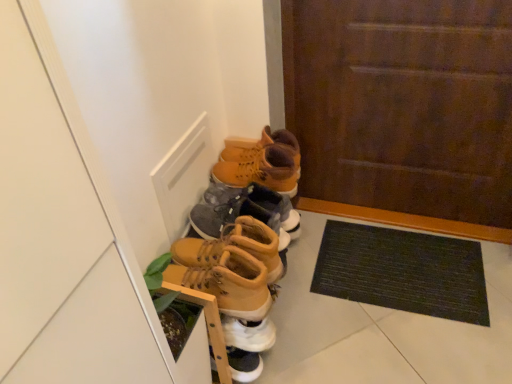
How much space does leather tan boots at center, which ranks as the third footwear in bottom-to-top order, occupy horizontally?

It is 13.01 inches.

This screenshot has height=384, width=512. Describe the element at coordinates (402, 271) in the screenshot. I see `black rubber doormat at lower right` at that location.

Where is `leather tan boots at center, the 5th footwear viewed from the top`? This screenshot has height=384, width=512. leather tan boots at center, the 5th footwear viewed from the top is located at coordinates (229, 283).

Measure the distance between leather tan boots at center, which is the first footwear in bottom-to-top order, and camera.

A distance of 1.02 meters exists between leather tan boots at center, which is the first footwear in bottom-to-top order, and camera.

Find the location of a particular element. matte yellow boots at center, which ranks as the 2th footwear in top-to-bottom order is located at coordinates (244, 211).

Image resolution: width=512 pixels, height=384 pixels. Find the location of `leather tan boots at center, which ranks as the third footwear in bottom-to-top order`. leather tan boots at center, which ranks as the third footwear in bottom-to-top order is located at coordinates (234, 245).

Based on their positions, is black rubber doormat at lower right located to the left or right of matte yellow boots at center, which ranks as the 2th footwear in top-to-bottom order?

Clearly, black rubber doormat at lower right is on the right of matte yellow boots at center, which ranks as the 2th footwear in top-to-bottom order, in the image.

Who is shorter, black rubber doormat at lower right or matte yellow boots at center, which ranks as the 2th footwear in top-to-bottom order?

black rubber doormat at lower right.

Is point (403, 239) less distant than point (217, 221)?

No.

How much distance is there between black rubber doormat at lower right and matte yellow boots at center, which ranks as the 2th footwear in top-to-bottom order?

black rubber doormat at lower right is 17.53 inches from matte yellow boots at center, which ranks as the 2th footwear in top-to-bottom order.

Who is smaller, black rubber doormat at lower right or matte brown boot at center, which appears as the second footwear when ordered from the bottom?

black rubber doormat at lower right.

Is black rubber doormat at lower right oriented away from matte brown boot at center, acting as the fourth footwear starting from the top?

No, matte brown boot at center, acting as the fourth footwear starting from the top, is not at the back of black rubber doormat at lower right.

What's the angular difference between black rubber doormat at lower right and matte brown boot at center, acting as the fourth footwear starting from the top,'s facing directions?

88.2 degrees separate the facing orientations of black rubber doormat at lower right and matte brown boot at center, acting as the fourth footwear starting from the top.

From a real-world perspective, is black rubber doormat at lower right physically above matte brown boot at center, which appears as the second footwear when ordered from the bottom?

No, from a real-world perspective, black rubber doormat at lower right is not over matte brown boot at center, which appears as the second footwear when ordered from the bottom

Could you tell me if leather tan boots at center, which is the first footwear in bottom-to-top order, is facing black rubber doormat at lower right?

No, leather tan boots at center, which is the first footwear in bottom-to-top order, is not aimed at black rubber doormat at lower right.

From the image's perspective, is leather tan boots at center, which is the first footwear in bottom-to-top order, above black rubber doormat at lower right?

Yes, from the image's perspective, leather tan boots at center, which is the first footwear in bottom-to-top order, is above black rubber doormat at lower right.

From a real-world perspective, is leather tan boots at center, which is the first footwear in bottom-to-top order, on black rubber doormat at lower right?

Yes, from a real-world perspective, leather tan boots at center, which is the first footwear in bottom-to-top order, is above black rubber doormat at lower right.

Is leather tan boots at center, which is the first footwear in bottom-to-top order, in front of or behind black rubber doormat at lower right in the image?

leather tan boots at center, which is the first footwear in bottom-to-top order, is positioned closer to the viewer than black rubber doormat at lower right.

Which is closer to the camera, (239,219) or (283,227)?

Point (239,219).

From a real-world perspective, is leather tan boots at center, which ranks as the third footwear in bottom-to-top order, above or below matte yellow boots at center, which ranks as the 2th footwear in top-to-bottom order?

In terms of real-world spatial position, leather tan boots at center, which ranks as the third footwear in bottom-to-top order, is below matte yellow boots at center, which ranks as the 2th footwear in top-to-bottom order.

Which object is further away from the camera, leather tan boots at center, which ranks as the third footwear in bottom-to-top order, or matte yellow boots at center, which is the 4th footwear from bottom to top?

matte yellow boots at center, which is the 4th footwear from bottom to top, is further from the camera.

Which object is positioned more to the right, leather tan boots at center, the third footwear in the top-to-bottom sequence, or matte yellow boots at center, which ranks as the 2th footwear in top-to-bottom order?

matte yellow boots at center, which ranks as the 2th footwear in top-to-bottom order, is more to the right.

From the image's perspective, is matte brown boot at center, acting as the fourth footwear starting from the top, located above leather tan boots at center, the third footwear in the top-to-bottom sequence?

No.

Considering the sizes of objects matte brown boot at center, acting as the fourth footwear starting from the top, and leather tan boots at center, which ranks as the third footwear in bottom-to-top order, in the image provided, who is taller, matte brown boot at center, acting as the fourth footwear starting from the top, or leather tan boots at center, which ranks as the third footwear in bottom-to-top order,?

With more height is matte brown boot at center, acting as the fourth footwear starting from the top.

Does matte brown boot at center, acting as the fourth footwear starting from the top, appear on the left side of leather tan boots at center, which ranks as the third footwear in bottom-to-top order?

In fact, matte brown boot at center, acting as the fourth footwear starting from the top, is to the right of leather tan boots at center, which ranks as the third footwear in bottom-to-top order.

From the image's perspective, which one is positioned higher, matte yellow leather boots at center, the fifth footwear ordered from the bottom, or matte yellow boots at center, which ranks as the 2th footwear in top-to-bottom order?

matte yellow leather boots at center, the fifth footwear ordered from the bottom, appears higher in the image.

Identify the location of footwear that is the 1st object located in front of the matte yellow leather boots at center, the fifth footwear ordered from the bottom. (244, 211).

Does point (274, 185) appear closer or farther from the camera than point (293, 211)?

Point (274, 185) is closer to the camera than point (293, 211).

Does matte yellow leather boots at center, the fifth footwear ordered from the bottom, lie behind matte yellow boots at center, which ranks as the 2th footwear in top-to-bottom order?

Yes.

Where is `doormat that is behind the leather tan boots at center, the 5th footwear viewed from the top`? The height and width of the screenshot is (384, 512). doormat that is behind the leather tan boots at center, the 5th footwear viewed from the top is located at coordinates (402, 271).

Consider the image. Which is correct: black rubber doormat at lower right is inside leather tan boots at center, the 5th footwear viewed from the top, or outside of it?

black rubber doormat at lower right is not inside leather tan boots at center, the 5th footwear viewed from the top, it's outside.

Is black rubber doormat at lower right facing towards leather tan boots at center, which is the first footwear in bottom-to-top order?

No, black rubber doormat at lower right is not aimed at leather tan boots at center, which is the first footwear in bottom-to-top order.

Considering the sizes of black rubber doormat at lower right and leather tan boots at center, the 5th footwear viewed from the top, in the image, is black rubber doormat at lower right taller or shorter than leather tan boots at center, the 5th footwear viewed from the top,?

black rubber doormat at lower right is shorter than leather tan boots at center, the 5th footwear viewed from the top.

Locate an element on the screen. This screenshot has height=384, width=512. doormat that is on the right side of matte yellow boots at center, which ranks as the 2th footwear in top-to-bottom order is located at coordinates (402, 271).

The image size is (512, 384). I want to click on doormat that appears behind the matte brown boot at center, acting as the fourth footwear starting from the top, so click(x=402, y=271).

When comparing their distances from brown wooden door at center, does matte brown boot at center, acting as the fourth footwear starting from the top, or leather tan boots at center, the third footwear in the top-to-bottom sequence, seem closer?

matte brown boot at center, acting as the fourth footwear starting from the top, lies closer to brown wooden door at center than the other object.

Estimate the real-world distances between objects in this image. Which object is closer to leather tan boots at center, which ranks as the third footwear in bottom-to-top order, matte brown boot at center, which appears as the second footwear when ordered from the bottom, or matte yellow boots at center, which is the 4th footwear from bottom to top?

matte yellow boots at center, which is the 4th footwear from bottom to top, is positioned closer to the anchor leather tan boots at center, which ranks as the third footwear in bottom-to-top order.

Based on their spatial positions, is leather tan boots at center, which is the first footwear in bottom-to-top order, or matte yellow boots at center, which is the 4th footwear from bottom to top, further from leather tan boots at center, which ranks as the third footwear in bottom-to-top order?

matte yellow boots at center, which is the 4th footwear from bottom to top, is positioned further to the anchor leather tan boots at center, which ranks as the third footwear in bottom-to-top order.

From the image, which object appears to be nearer to leather tan boots at center, which is the first footwear in bottom-to-top order, black rubber doormat at lower right or matte yellow boots at center, which ranks as the 2th footwear in top-to-bottom order?

Among the two, matte yellow boots at center, which ranks as the 2th footwear in top-to-bottom order, is located nearer to leather tan boots at center, which is the first footwear in bottom-to-top order.

Estimate the real-world distances between objects in this image. Which object is closer to matte brown boot at center, acting as the fourth footwear starting from the top, matte yellow leather boots at center, the fifth footwear ordered from the bottom, or black rubber doormat at lower right?

matte yellow leather boots at center, the fifth footwear ordered from the bottom.

Which object lies further to the anchor point matte brown boot at center, acting as the fourth footwear starting from the top, black rubber doormat at lower right or matte yellow leather boots at center, the fifth footwear ordered from the bottom?

black rubber doormat at lower right lies further to matte brown boot at center, acting as the fourth footwear starting from the top, than the other object.

Based on their spatial positions, is matte yellow boots at center, which is the 4th footwear from bottom to top, or leather tan boots at center, which ranks as the third footwear in bottom-to-top order, closer to matte yellow leather boots at center, positioned as the first footwear in top-to-bottom order?

The object closer to matte yellow leather boots at center, positioned as the first footwear in top-to-bottom order, is matte yellow boots at center, which is the 4th footwear from bottom to top.

Based on their spatial positions, is matte yellow boots at center, which is the 4th footwear from bottom to top, or matte yellow leather boots at center, the fifth footwear ordered from the bottom, further from black rubber doormat at lower right?

The object further to black rubber doormat at lower right is matte yellow leather boots at center, the fifth footwear ordered from the bottom.

Find the location of a particular element. Image resolution: width=512 pixels, height=384 pixels. doormat located between leather tan boots at center, which is the first footwear in bottom-to-top order, and brown wooden door at center in the left-right direction is located at coordinates coord(402,271).

This screenshot has height=384, width=512. In order to click on doormat between matte yellow leather boots at center, positioned as the first footwear in top-to-bottom order, and brown wooden door at center in this screenshot , I will do `click(402, 271)`.

Where is `doormat between matte brown boot at center, which appears as the second footwear when ordered from the bottom, and brown wooden door at center`? doormat between matte brown boot at center, which appears as the second footwear when ordered from the bottom, and brown wooden door at center is located at coordinates (402, 271).

Find the location of a particular element. Image resolution: width=512 pixels, height=384 pixels. doormat situated between leather tan boots at center, the third footwear in the top-to-bottom sequence, and brown wooden door at center from left to right is located at coordinates (402, 271).